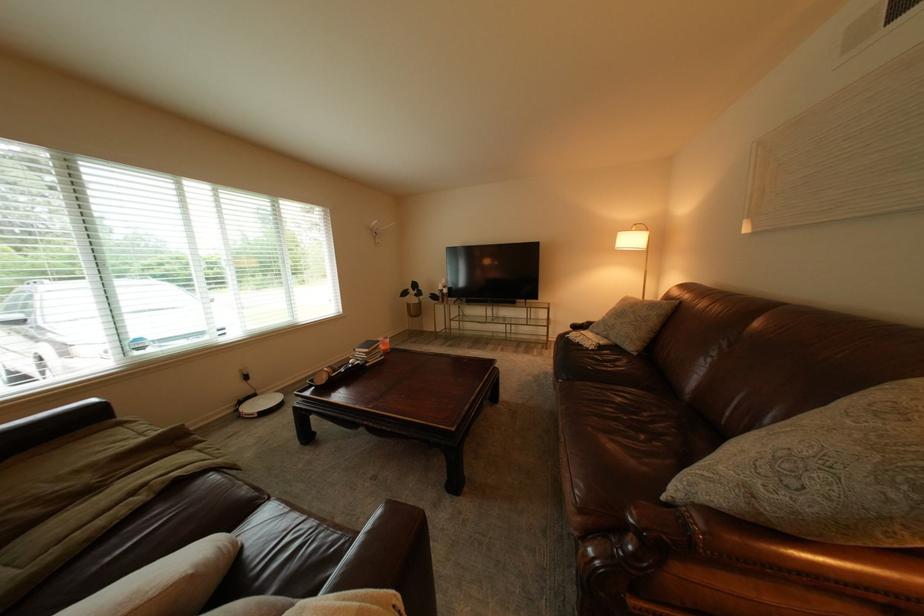
Locate an element on the screen. stack of books is located at coordinates (368, 353).